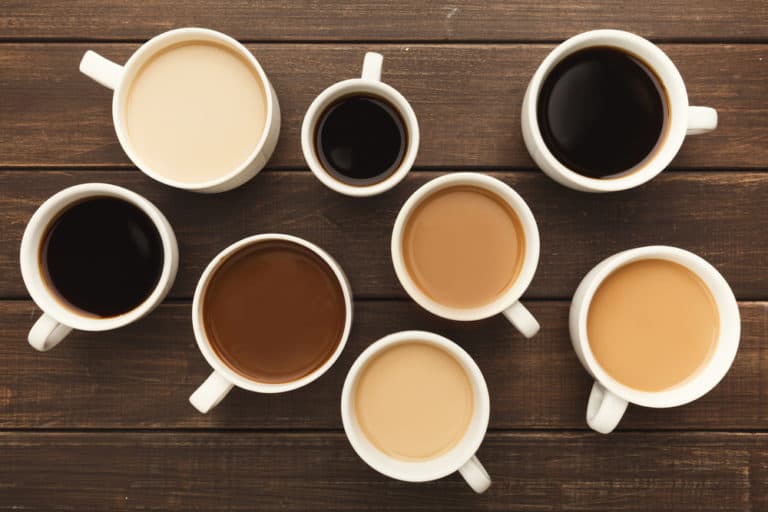
Locate an element on the screen. This screenshot has width=768, height=512. cup handles is located at coordinates (107, 71), (372, 67), (702, 119), (521, 318), (606, 414), (477, 477), (210, 391), (45, 333).